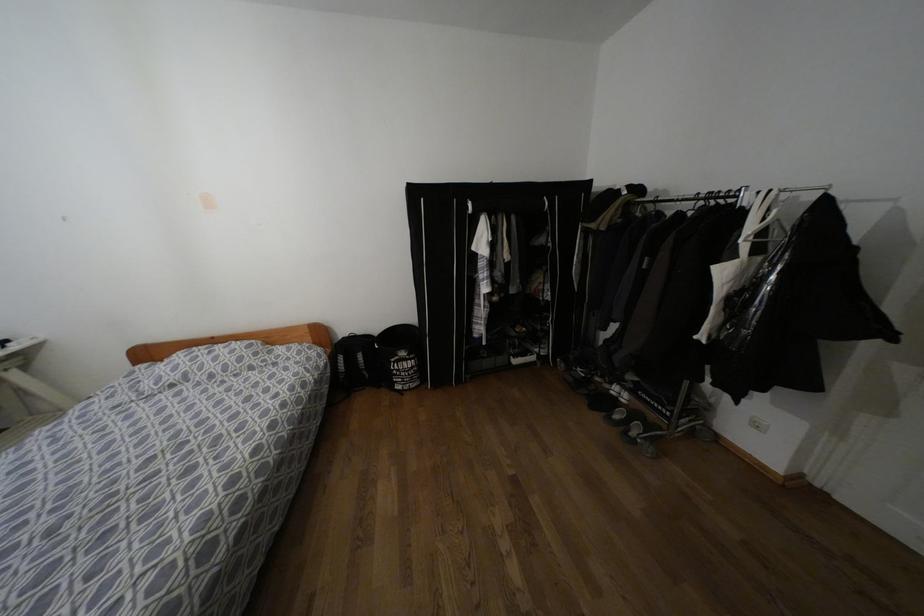
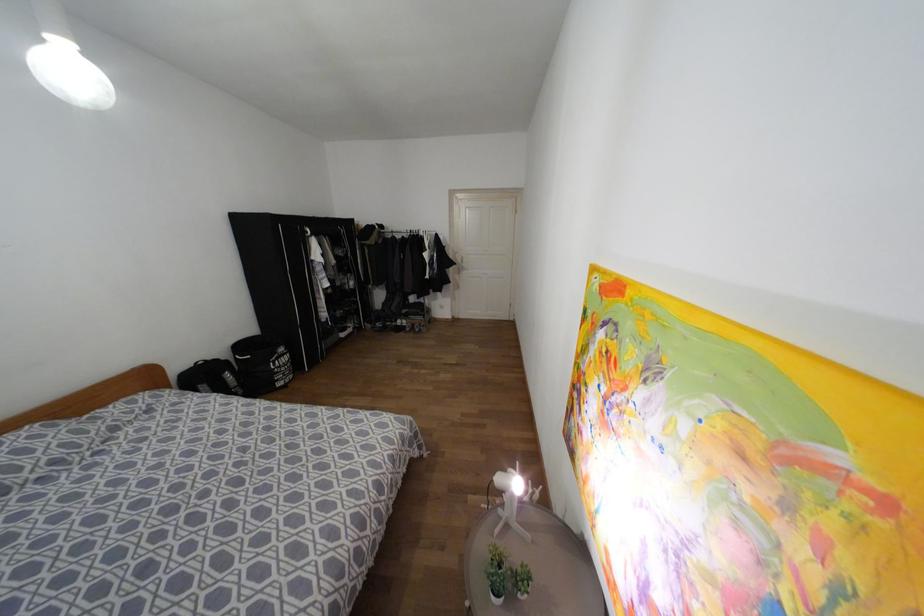
In the second image, find the point that corresponds to point (402, 353) in the first image.

(281, 349)